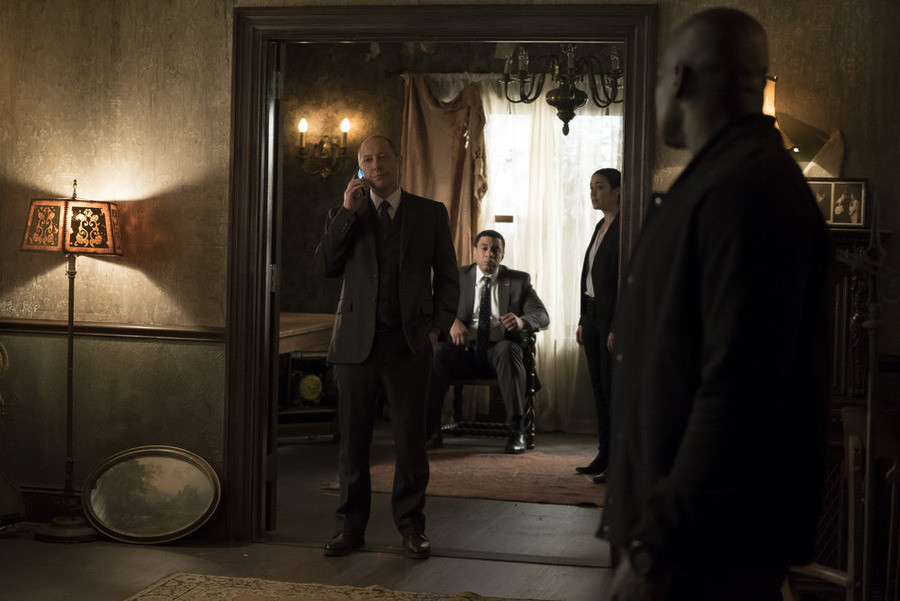
Find the location of a particular element. This screenshot has width=900, height=601. frame is located at coordinates (169, 337).